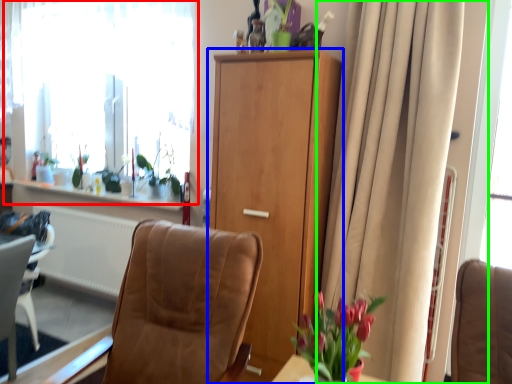
Question: Based on their relative distances, which object is nearer to window (highlighted by a red box)? Choose from cabinetry (highlighted by a blue box) and curtain (highlighted by a green box).

Choices:
 (A) cabinetry
 (B) curtain

Answer: (A)